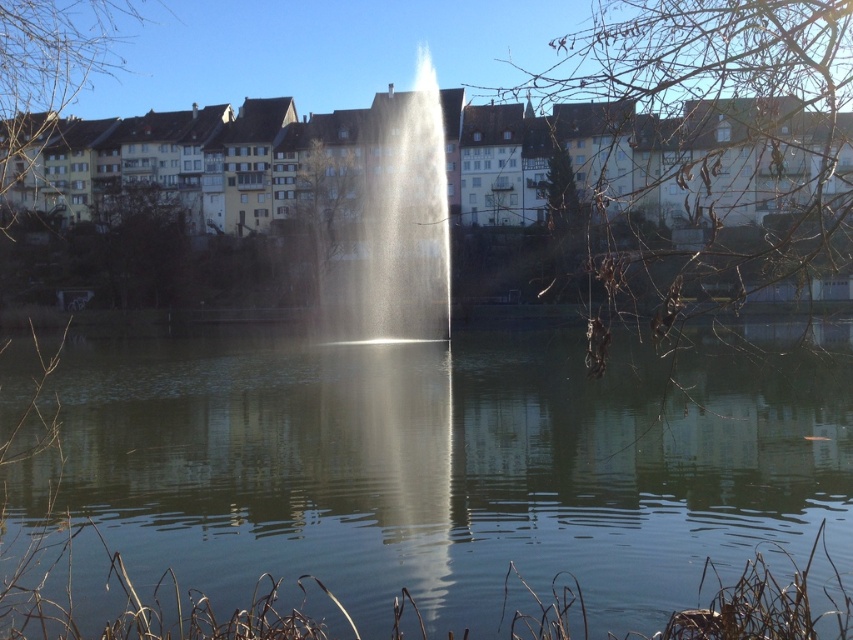
You are standing at the riverside and looking at two points in the image. The first point is at coordinates point (463, 445) and the second is at point (355, 172). Which point is closer to you?

Point (463, 445) is closer to the camera than point (355, 172).

You are standing on the riverside and want to take a photo of the clear water at center and the clear glass fountain at center. Which object should you focus on first if you want to capture both in one shot without moving the camera?

You should focus on the clear glass fountain at center first because the clear water at center is positioned on the left side of it, so adjusting focus to the fountain ensures both are within the frame.